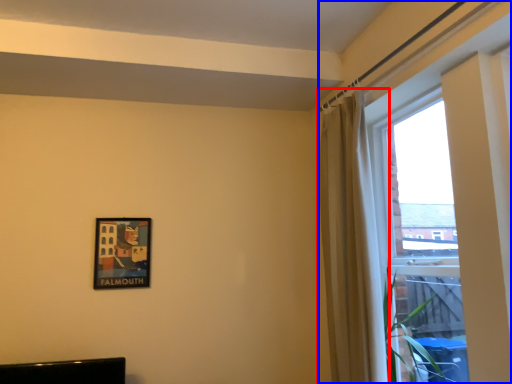
Question: Which point is closer to the camera, curtain (highlighted by a red box) or window (highlighted by a blue box)?

Choices:
 (A) curtain
 (B) window

Answer: (B)